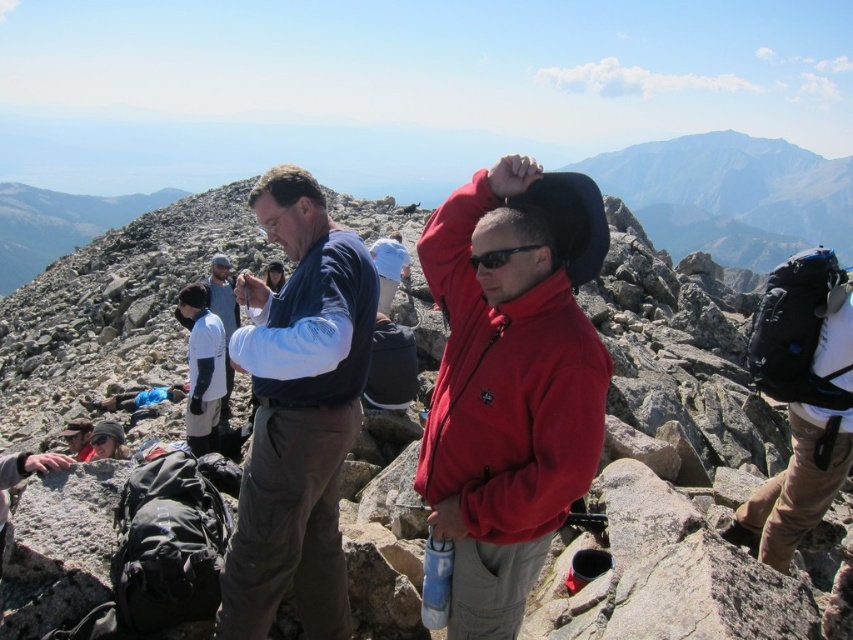
Can you confirm if blue fleece jacket at center is thinner than white cotton shirt at center?

Indeed, blue fleece jacket at center has a lesser width compared to white cotton shirt at center.

Between point (329, 548) and point (229, 307), which one is positioned in front?

Point (329, 548) is in front.

Which is behind, point (270, 557) or point (231, 330)?

The point (231, 330) is behind.

I want to click on blue fleece jacket at center, so click(x=297, y=413).

Does rugged stone mountain at center appear over blue fleece jacket at center?

Yes.

Is the position of rugged stone mountain at center more distant than that of blue fleece jacket at center?

No.

Is point (540, 356) farther from viewer compared to point (316, 525)?

No, (540, 356) is closer to viewer.

Where is `rugged stone mountain at center`? rugged stone mountain at center is located at coordinates (556, 456).

What are the coordinates of `rugged stone mountain at center` in the screenshot? It's located at (556, 456).

Does rugged stone mountain at center have a smaller size compared to white cotton shirt at center?

No, rugged stone mountain at center is not smaller than white cotton shirt at center.

Identify the location of rugged stone mountain at center. The width and height of the screenshot is (853, 640). (556, 456).

Locate an element on the screen. rugged stone mountain at center is located at coordinates (556, 456).